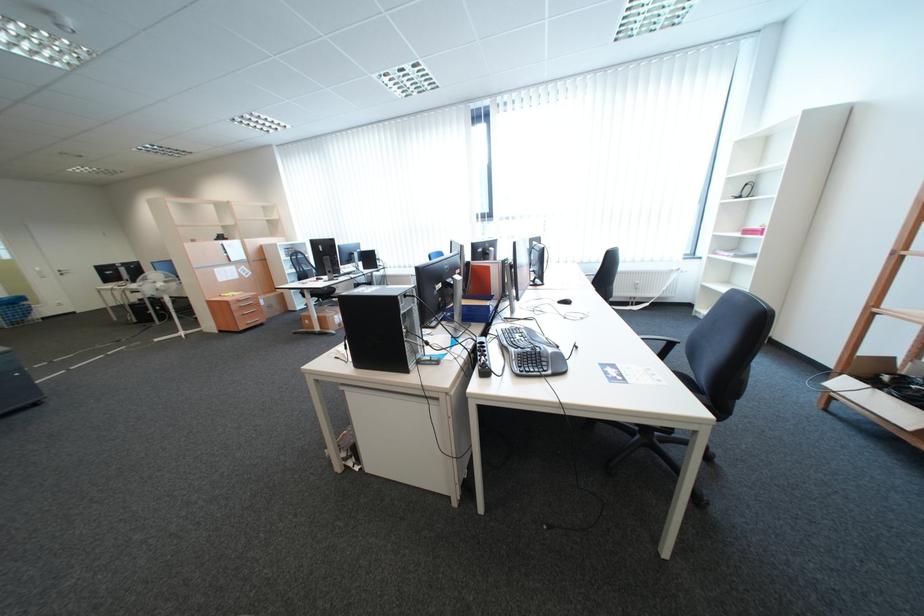
The image size is (924, 616). Find the location of `black chair armrest`. black chair armrest is located at coordinates (661, 334).